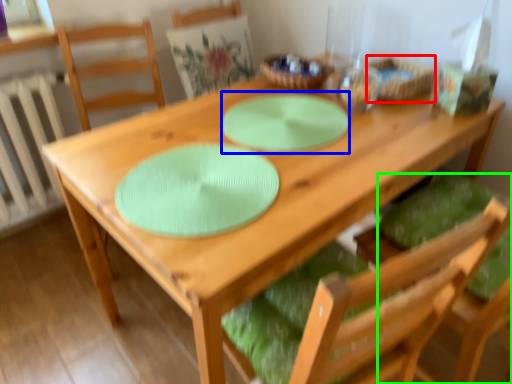
Question: Which object is positioned closest to basket (highlighted by a red box)? Select from glass plate (highlighted by a blue box) and chair (highlighted by a green box).

Choices:
 (A) glass plate
 (B) chair

Answer: (A)